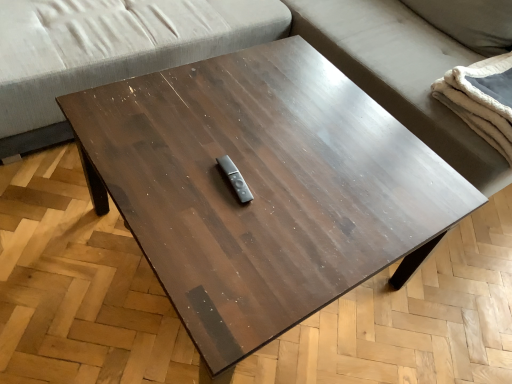
Question: From a real-world perspective, is gray fabric studio couch at upper center over gray fabric couch at upper center?

Choices:
 (A) no
 (B) yes

Answer: (B)

Question: Does gray fabric studio couch at upper center have a lesser height compared to gray fabric couch at upper center?

Choices:
 (A) no
 (B) yes

Answer: (A)

Question: Is gray fabric studio couch at upper center facing towards gray fabric couch at upper center?

Choices:
 (A) no
 (B) yes

Answer: (A)

Question: Is gray fabric studio couch at upper center positioned with its back to gray fabric couch at upper center?

Choices:
 (A) yes
 (B) no

Answer: (B)

Question: Is the depth of gray fabric studio couch at upper center greater than that of gray fabric couch at upper center?

Choices:
 (A) no
 (B) yes

Answer: (A)

Question: Considering their positions, is white fluffy blanket at right located in front of or behind gray fabric couch at upper center?

Choices:
 (A) front
 (B) behind

Answer: (B)

Question: From their relative heights in the image, would you say white fluffy blanket at right is taller or shorter than gray fabric couch at upper center?

Choices:
 (A) tall
 (B) short

Answer: (B)

Question: Considering the positions of white fluffy blanket at right and gray fabric couch at upper center in the image, is white fluffy blanket at right wider or thinner than gray fabric couch at upper center?

Choices:
 (A) thin
 (B) wide

Answer: (A)

Question: Considering the positions of white fluffy blanket at right and gray fabric couch at upper center in the image, is white fluffy blanket at right bigger or smaller than gray fabric couch at upper center?

Choices:
 (A) big
 (B) small

Answer: (B)

Question: Considering their positions, is gray fabric studio couch at upper center located in front of or behind white fluffy blanket at right?

Choices:
 (A) front
 (B) behind

Answer: (A)

Question: Is point (472, 160) closer or farther from the camera than point (481, 61)?

Choices:
 (A) farther
 (B) closer

Answer: (B)

Question: From their relative heights in the image, would you say gray fabric studio couch at upper center is taller or shorter than white fluffy blanket at right?

Choices:
 (A) short
 (B) tall

Answer: (B)

Question: Considering the relative positions of gray fabric studio couch at upper center and white fluffy blanket at right in the image provided, is gray fabric studio couch at upper center to the left or to the right of white fluffy blanket at right?

Choices:
 (A) right
 (B) left

Answer: (B)

Question: From a real-world perspective, relative to gray fabric couch at upper center, is gray fabric studio couch at upper center vertically above or below?

Choices:
 (A) below
 (B) above

Answer: (B)

Question: Looking at their shapes, would you say gray fabric studio couch at upper center is wider or thinner than gray fabric couch at upper center?

Choices:
 (A) thin
 (B) wide

Answer: (B)